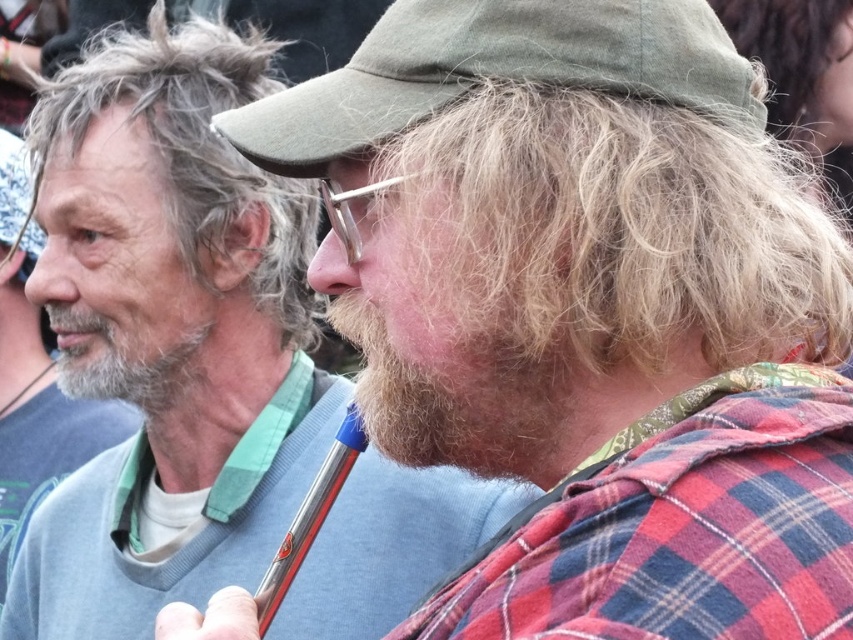
Is point (442, 12) behind point (16, 365)?

No, it is in front of (16, 365).

Who is positioned more to the left, green fabric cap at center or gray beard at left?

From the viewer's perspective, gray beard at left appears more on the left side.

Identify the location of green fabric cap at center. The width and height of the screenshot is (853, 640). (494, 70).

Is red plaid shirt at right taller than grayish blonde hair at upper left?

No, red plaid shirt at right is not taller than grayish blonde hair at upper left.

Looking at this image, between red plaid shirt at right and grayish blonde hair at upper left, which one appears on the left side from the viewer's perspective?

grayish blonde hair at upper left

Which is behind, point (790, 532) or point (300, 262)?

The point (300, 262) is more distant.

The height and width of the screenshot is (640, 853). What are the coordinates of `red plaid shirt at right` in the screenshot? It's located at (680, 525).

Which is more to the left, red plaid shirt at right or gray beard at left?

gray beard at left

Does red plaid shirt at right appear over gray beard at left?

Actually, red plaid shirt at right is below gray beard at left.

The image size is (853, 640). Identify the location of red plaid shirt at right. (680, 525).